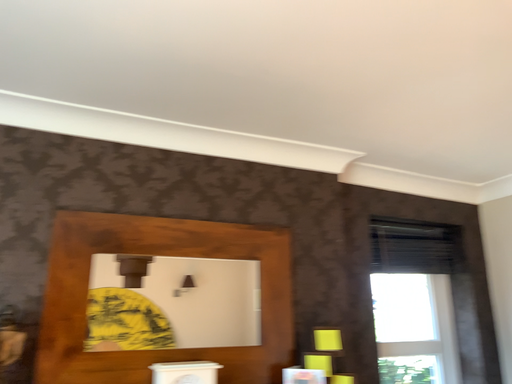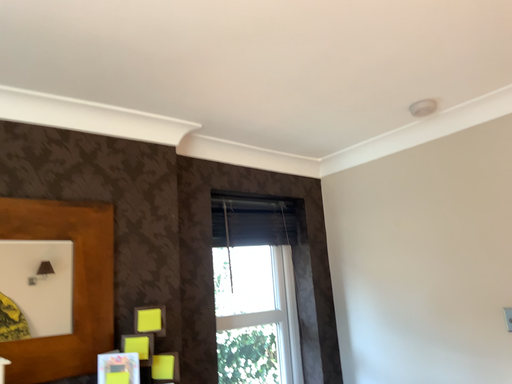
Question: Which way did the camera rotate in the video?

Choices:
 (A) rotated right
 (B) rotated left

Answer: (A)